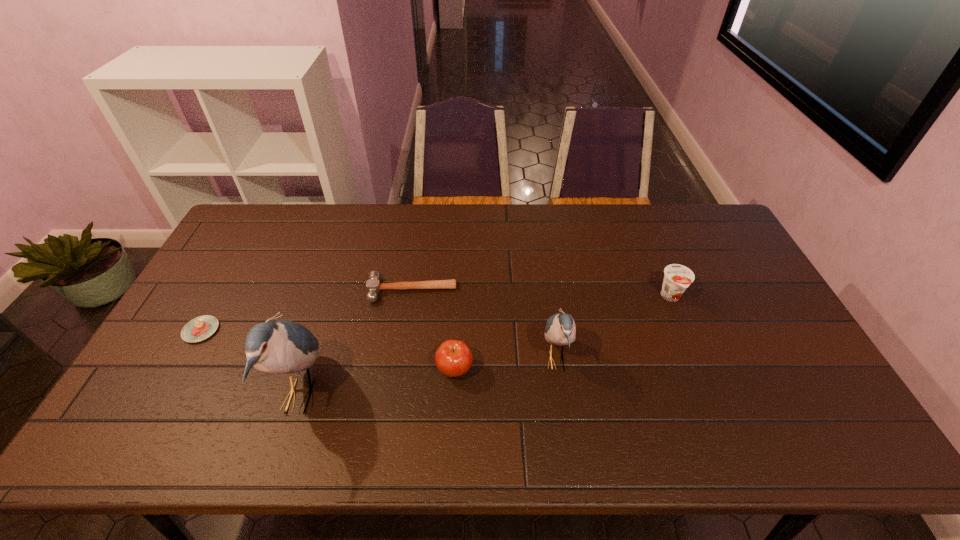
What are the coordinates of `the tallest object` in the screenshot? It's located at (275, 346).

Where is `the taller bird`? the taller bird is located at coordinates (275, 346).

Find the location of `the second tallest object`. the second tallest object is located at coordinates (560, 329).

Locate an element on the screen. the shorter bird is located at coordinates (560, 329).

Find the location of a particular element. the rightmost object is located at coordinates (677, 278).

Find the location of a particular element. This screenshot has height=540, width=960. the shortest object is located at coordinates [x=200, y=328].

Where is `the leftmost object`? This screenshot has height=540, width=960. the leftmost object is located at coordinates (200, 328).

What are the coordinates of `hammer` in the screenshot? It's located at (373, 286).

The height and width of the screenshot is (540, 960). Identify the location of apple. (453, 358).

The width and height of the screenshot is (960, 540). In order to click on vacant space located at the tip of the taller bird's beak in this screenshot , I will do `click(459, 395)`.